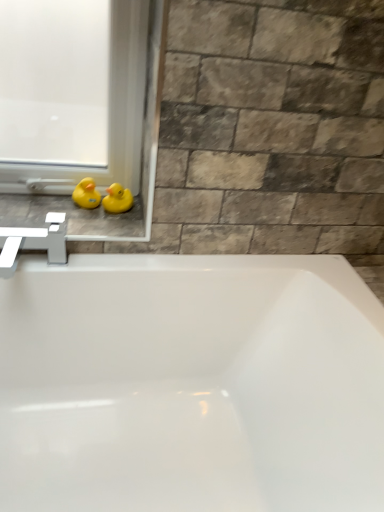
Question: Is yellow rubber duck at left facing towards yellow rubber duck at left, the 1th duck when ordered from left to right?

Choices:
 (A) yes
 (B) no

Answer: (B)

Question: Would you consider yellow rubber duck at left to be distant from yellow rubber duck at left, which is the 2th duck in right-to-left order?

Choices:
 (A) yes
 (B) no

Answer: (B)

Question: From a real-world perspective, is yellow rubber duck at left located higher than yellow rubber duck at left, which is the 2th duck in right-to-left order?

Choices:
 (A) yes
 (B) no

Answer: (B)

Question: Considering the relative sizes of yellow rubber duck at left and yellow rubber duck at left, which is the 2th duck in right-to-left order, in the image provided, is yellow rubber duck at left smaller than yellow rubber duck at left, which is the 2th duck in right-to-left order,?

Choices:
 (A) no
 (B) yes

Answer: (A)

Question: Would you say yellow rubber duck at left, which is the 2th duck in right-to-left order, is part of yellow rubber duck at left's contents?

Choices:
 (A) yes
 (B) no

Answer: (B)

Question: Are yellow rubber duck at left and yellow rubber duck at left, the 1th duck when ordered from left to right, beside each other?

Choices:
 (A) no
 (B) yes

Answer: (A)

Question: From the image's perspective, does white plastic window frame at lower left appear lower than yellow rubber duck at left, which is the 2th duck in right-to-left order?

Choices:
 (A) yes
 (B) no

Answer: (B)

Question: From a real-world perspective, is white plastic window frame at lower left positioned under yellow rubber duck at left, which is the 2th duck in right-to-left order, based on gravity?

Choices:
 (A) yes
 (B) no

Answer: (B)

Question: Are white plastic window frame at lower left and yellow rubber duck at left, the 1th duck when ordered from left to right, located far from each other?

Choices:
 (A) no
 (B) yes

Answer: (A)

Question: Does white plastic window frame at lower left have a smaller size compared to yellow rubber duck at left, which is the 2th duck in right-to-left order?

Choices:
 (A) no
 (B) yes

Answer: (A)

Question: Considering the relative positions of white plastic window frame at lower left and yellow rubber duck at left, the 1th duck when ordered from left to right, in the image provided, is white plastic window frame at lower left behind yellow rubber duck at left, the 1th duck when ordered from left to right,?

Choices:
 (A) yes
 (B) no

Answer: (B)

Question: From a real-world perspective, does white plastic window frame at lower left stand above yellow rubber duck at left, the 1th duck when ordered from left to right?

Choices:
 (A) no
 (B) yes

Answer: (B)

Question: Is yellow rubber duck at left, the 1th duck when ordered from left to right, outside of yellow rubber duck at left?

Choices:
 (A) no
 (B) yes

Answer: (B)